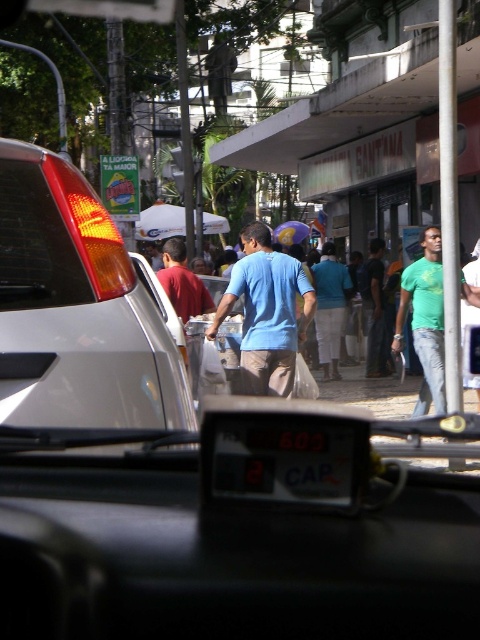
Question: Which of these objects is positioned farthest from the matte silver car at left?

Choices:
 (A) blue matte shirt at center
 (B) green matte shirt at center
 (C) light blue shirt at center
 (D) black plastic license plate at center

Answer: (C)

Question: Is green matte shirt at center below light blue shirt at center?

Choices:
 (A) yes
 (B) no

Answer: (A)

Question: Estimate the real-world distances between objects in this image. Which object is farther from the black plastic license plate at center?

Choices:
 (A) matte silver car at left
 (B) green matte shirt at center
 (C) light blue shirt at center
 (D) blue matte shirt at center

Answer: (C)

Question: Is the position of blue matte shirt at center more distant than that of light blue shirt at center?

Choices:
 (A) yes
 (B) no

Answer: (B)

Question: Can you confirm if matte silver car at left is smaller than blue matte shirt at center?

Choices:
 (A) no
 (B) yes

Answer: (B)

Question: Which object is the farthest from the matte silver car at left?

Choices:
 (A) light blue shirt at center
 (B) green matte shirt at center

Answer: (A)